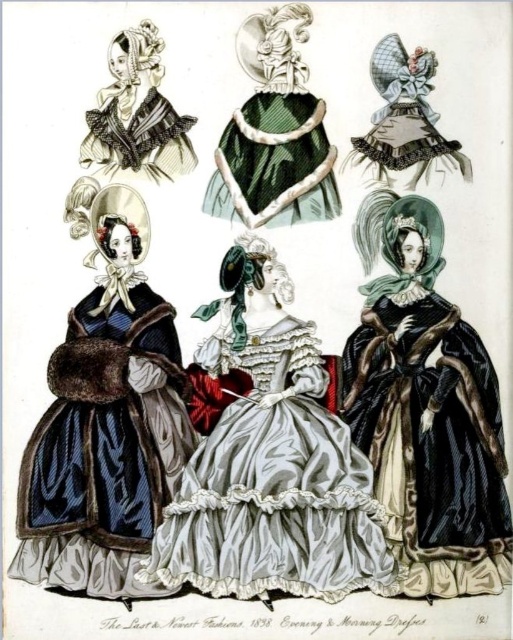
Consider the image. You are an interior designer planning to place a velvet fur coat at left and a matte black bonnet at upper left in a display case. The display case is 50 feet long. Can both items be placed end to end without overlapping?

The velvet fur coat at left is 47.01 feet from matte black bonnet at upper left, so yes, both items can be placed end to end in the 50 feet display case since their combined distance is less than the case length.

You are a fashion historian examining the 1838 illustration. You need to determine which garment is shorter in height between the silvery satin gown at center and the velvet black cape at right. Which one is shorter?

The silvery satin gown at center is not as tall as the velvet black cape at right, so the silvery satin gown at center is shorter in height.